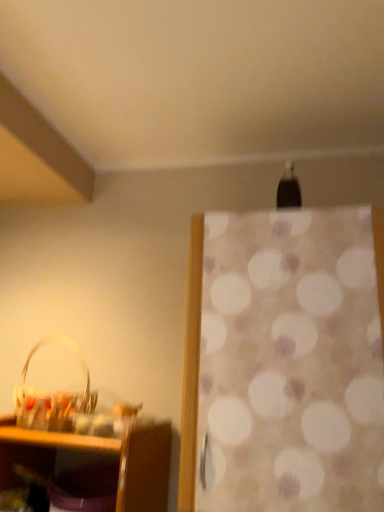
Question: In terms of height, does white dotted fabric at center look taller or shorter compared to translucent plastic basket at lower left?

Choices:
 (A) short
 (B) tall

Answer: (B)

Question: Based on their sizes in the image, would you say white dotted fabric at center is bigger or smaller than translucent plastic basket at lower left?

Choices:
 (A) big
 (B) small

Answer: (A)

Question: Is white dotted fabric at center in front of or behind translucent plastic basket at lower left in the image?

Choices:
 (A) front
 (B) behind

Answer: (A)

Question: Looking at their shapes, would you say translucent plastic basket at lower left is wider or thinner than white dotted fabric at center?

Choices:
 (A) wide
 (B) thin

Answer: (B)

Question: Is point (66, 339) positioned closer to the camera than point (332, 370)?

Choices:
 (A) farther
 (B) closer

Answer: (A)

Question: From the image's perspective, relative to white dotted fabric at center, is translucent plastic basket at lower left above or below?

Choices:
 (A) above
 (B) below

Answer: (B)

Question: Considering the positions of translucent plastic basket at lower left and white dotted fabric at center in the image, is translucent plastic basket at lower left taller or shorter than white dotted fabric at center?

Choices:
 (A) tall
 (B) short

Answer: (B)